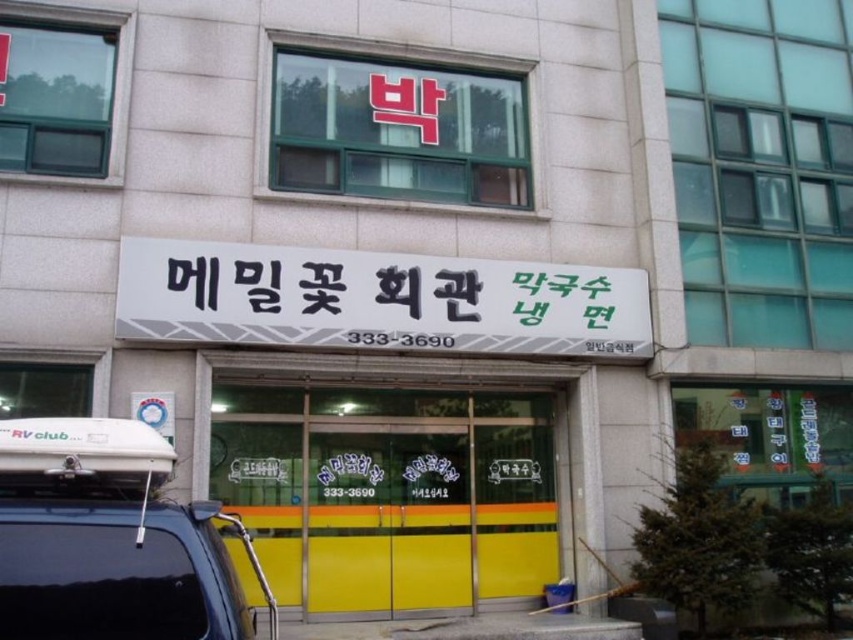
Who is positioned more to the right, black plastic signboard at center or black matte suv at lower left?

Positioned to the right is black plastic signboard at center.

From the picture: How distant is black plastic signboard at center from black matte suv at lower left?

black plastic signboard at center is 9.81 feet from black matte suv at lower left.

The height and width of the screenshot is (640, 853). Find the location of `black plastic signboard at center`. black plastic signboard at center is located at coordinates (376, 300).

Does yellow matte door at center have a greater height compared to black plastic signboard at center?

Yes.

Is point (360, 589) positioned in front of point (149, 256)?

No.

Find the location of a particular element. The width and height of the screenshot is (853, 640). yellow matte door at center is located at coordinates (389, 492).

Does yellow matte door at center appear on the right side of black matte suv at lower left?

Correct, you'll find yellow matte door at center to the right of black matte suv at lower left.

Is point (428, 486) in front of point (103, 637)?

No, it is behind (103, 637).

Between point (485, 561) and point (50, 513), which one is positioned behind?

The point (485, 561) is more distant.

At what (x,y) coordinates should I click in order to perform the action: click on yellow matte door at center. Please return your answer as a coordinate pair (x, y). The height and width of the screenshot is (640, 853). Looking at the image, I should click on (389, 492).